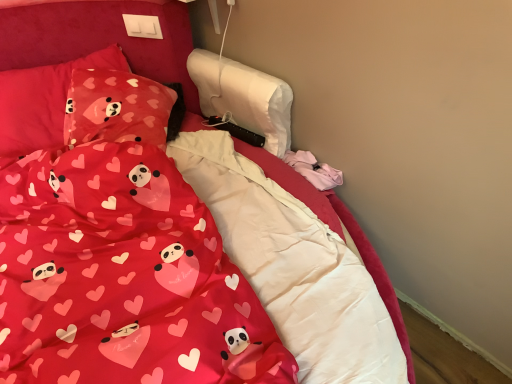
The image size is (512, 384). What are the coordinates of `matte pink fabric pillow at upper left, which is the second pillow in right-to-left order` in the screenshot? It's located at (42, 101).

Measure the distance between point (25,80) and camera.

Point (25,80) is 5.38 feet away from camera.

In order to click on matte fabric pillow at upper left, which appears as the 1th pillow when viewed from the right in this screenshot , I will do `click(116, 108)`.

Locate an element on the screen. The width and height of the screenshot is (512, 384). matte pink fabric pillow at upper left, which is the second pillow in right-to-left order is located at coordinates (42, 101).

Can you confirm if matte fabric pillow at upper left, which appears as the 1th pillow when viewed from the right, is thinner than matte red fabric at center?

Yes, matte fabric pillow at upper left, which appears as the 1th pillow when viewed from the right, is thinner than matte red fabric at center.

Could you tell me if matte fabric pillow at upper left, which appears as the 1th pillow when viewed from the right, is facing matte red fabric at center?

Yes, matte fabric pillow at upper left, which appears as the 1th pillow when viewed from the right, is aimed at matte red fabric at center.

What's the angular difference between matte fabric pillow at upper left, which is the second pillow in left-to-right order, and matte red fabric at center's facing directions?

matte fabric pillow at upper left, which is the second pillow in left-to-right order, and matte red fabric at center are facing 26.2 degrees away from each other.

How distant is matte red fabric at center from matte fabric pillow at upper left, which is the second pillow in left-to-right order?

matte red fabric at center is 19.79 inches away from matte fabric pillow at upper left, which is the second pillow in left-to-right order.

Could you tell me if matte red fabric at center is turned towards matte fabric pillow at upper left, which is the second pillow in left-to-right order?

No, matte red fabric at center is not aimed at matte fabric pillow at upper left, which is the second pillow in left-to-right order.

Between matte red fabric at center and matte fabric pillow at upper left, which appears as the 1th pillow when viewed from the right, which one has smaller size?

With smaller size is matte fabric pillow at upper left, which appears as the 1th pillow when viewed from the right.

Does point (14, 155) come closer to viewer compared to point (157, 337)?

No, it is behind (157, 337).

Can you confirm if matte pink fabric pillow at upper left, which is the second pillow in right-to-left order, is smaller than matte red fabric at center?

Correct, matte pink fabric pillow at upper left, which is the second pillow in right-to-left order, occupies less space than matte red fabric at center.

From the picture: Is matte pink fabric pillow at upper left, the 1th pillow viewed from the left, facing towards matte red fabric at center?

Yes, matte pink fabric pillow at upper left, the 1th pillow viewed from the left, is aimed at matte red fabric at center.

Do you think matte pink fabric pillow at upper left, which is the second pillow in right-to-left order, is within matte red fabric at center, or outside of it?

matte pink fabric pillow at upper left, which is the second pillow in right-to-left order, is outside matte red fabric at center.

From their relative heights in the image, would you say matte red fabric at center is taller or shorter than matte pink fabric pillow at upper left, which is the second pillow in right-to-left order?

Clearly, matte red fabric at center is taller compared to matte pink fabric pillow at upper left, which is the second pillow in right-to-left order.

Between matte red fabric at center and matte pink fabric pillow at upper left, which is the second pillow in right-to-left order, which one appears on the left side from the viewer's perspective?

Positioned to the left is matte pink fabric pillow at upper left, which is the second pillow in right-to-left order.

Where is `the 1st pillow located beneath the matte red fabric at center (from a real-world perspective)`? The image size is (512, 384). the 1st pillow located beneath the matte red fabric at center (from a real-world perspective) is located at coordinates (42, 101).

From a real-world perspective, which is physically above, matte red fabric at center or matte pink fabric pillow at upper left, which is the second pillow in right-to-left order?

matte red fabric at center.

Is matte pink fabric pillow at upper left, the 1th pillow viewed from the left, with matte fabric pillow at upper left, which appears as the 1th pillow when viewed from the right?

No, matte pink fabric pillow at upper left, the 1th pillow viewed from the left, is not making contact with matte fabric pillow at upper left, which appears as the 1th pillow when viewed from the right.

Considering the sizes of matte pink fabric pillow at upper left, which is the second pillow in right-to-left order, and matte fabric pillow at upper left, which appears as the 1th pillow when viewed from the right, in the image, is matte pink fabric pillow at upper left, which is the second pillow in right-to-left order, bigger or smaller than matte fabric pillow at upper left, which appears as the 1th pillow when viewed from the right,?

matte pink fabric pillow at upper left, which is the second pillow in right-to-left order, is bigger than matte fabric pillow at upper left, which appears as the 1th pillow when viewed from the right.

At what (x,y) coordinates should I click in order to perform the action: click on pillow that is below the matte pink fabric pillow at upper left, the 1th pillow viewed from the left (from the image's perspective). Please return your answer as a coordinate pair (x, y). Looking at the image, I should click on (116, 108).

Which object is closer to the camera, matte pink fabric pillow at upper left, the 1th pillow viewed from the left, or matte fabric pillow at upper left, which is the second pillow in left-to-right order?

matte fabric pillow at upper left, which is the second pillow in left-to-right order, is more forward.

Is matte fabric pillow at upper left, which is the second pillow in left-to-right order, shorter than matte pink fabric pillow at upper left, which is the second pillow in right-to-left order?

Yes, matte fabric pillow at upper left, which is the second pillow in left-to-right order, is shorter than matte pink fabric pillow at upper left, which is the second pillow in right-to-left order.

Does matte fabric pillow at upper left, which is the second pillow in left-to-right order, appear on the right side of matte pink fabric pillow at upper left, the 1th pillow viewed from the left?

Indeed, matte fabric pillow at upper left, which is the second pillow in left-to-right order, is positioned on the right side of matte pink fabric pillow at upper left, the 1th pillow viewed from the left.

Is matte fabric pillow at upper left, which appears as the 1th pillow when viewed from the right, inside the boundaries of matte pink fabric pillow at upper left, the 1th pillow viewed from the left, or outside?

matte fabric pillow at upper left, which appears as the 1th pillow when viewed from the right, fits inside matte pink fabric pillow at upper left, the 1th pillow viewed from the left.

Which of these two, matte fabric pillow at upper left, which is the second pillow in left-to-right order, or matte pink fabric pillow at upper left, which is the second pillow in right-to-left order, is wider?

Wider between the two is matte pink fabric pillow at upper left, which is the second pillow in right-to-left order.

You are a GUI agent. You are given a task and a screenshot of the screen. Output one action in this format:
    pyautogui.click(x=<x>, y=<y>)
    Task: Click on the blanket that appears on the right of matte fabric pillow at upper left, which appears as the 1th pillow when viewed from the right
    This screenshot has width=512, height=384.
    Given the screenshot: What is the action you would take?
    pyautogui.click(x=122, y=277)

Identify the location of the 1st pillow behind the matte red fabric at center. The width and height of the screenshot is (512, 384). (116, 108).

Considering their positions, is matte pink fabric pillow at upper left, which is the second pillow in right-to-left order, positioned closer to matte fabric pillow at upper left, which appears as the 1th pillow when viewed from the right, than matte red fabric at center?

Among the two, matte pink fabric pillow at upper left, which is the second pillow in right-to-left order, is located nearer to matte fabric pillow at upper left, which appears as the 1th pillow when viewed from the right.

Based on their spatial positions, is matte fabric pillow at upper left, which appears as the 1th pillow when viewed from the right, or matte pink fabric pillow at upper left, the 1th pillow viewed from the left, closer to matte red fabric at center?

The object closer to matte red fabric at center is matte fabric pillow at upper left, which appears as the 1th pillow when viewed from the right.

Based on their spatial positions, is matte pink fabric pillow at upper left, which is the second pillow in right-to-left order, or matte fabric pillow at upper left, which is the second pillow in left-to-right order, closer to matte red fabric at center?

Among the two, matte fabric pillow at upper left, which is the second pillow in left-to-right order, is located nearer to matte red fabric at center.

Estimate the real-world distances between objects in this image. Which object is closer to matte fabric pillow at upper left, which is the second pillow in left-to-right order, matte red fabric at center or matte pink fabric pillow at upper left, which is the second pillow in right-to-left order?

matte pink fabric pillow at upper left, which is the second pillow in right-to-left order, lies closer to matte fabric pillow at upper left, which is the second pillow in left-to-right order, than the other object.

Which object lies further to the anchor point matte pink fabric pillow at upper left, the 1th pillow viewed from the left, matte fabric pillow at upper left, which appears as the 1th pillow when viewed from the right, or matte red fabric at center?

The object further to matte pink fabric pillow at upper left, the 1th pillow viewed from the left, is matte red fabric at center.

Considering their positions, is matte red fabric at center positioned further to matte pink fabric pillow at upper left, the 1th pillow viewed from the left, than matte fabric pillow at upper left, which is the second pillow in left-to-right order?

matte red fabric at center lies further to matte pink fabric pillow at upper left, the 1th pillow viewed from the left, than the other object.

Find the location of a particular element. pillow between matte red fabric at center and matte pink fabric pillow at upper left, which is the second pillow in right-to-left order, from front to back is located at coordinates [x=116, y=108].